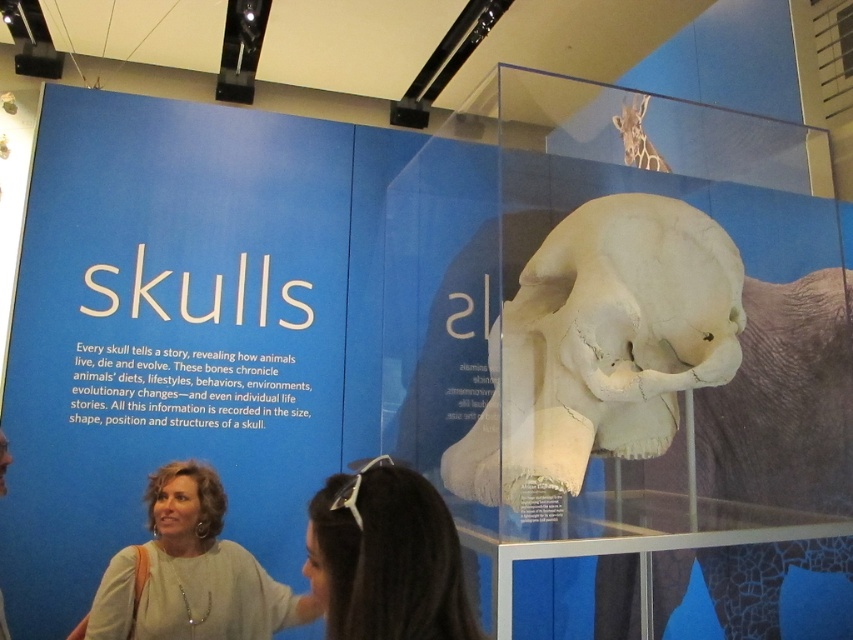
Who is taller, white matte skull at center or light beige sweater at lower left?

With more height is white matte skull at center.

Between white matte skull at center and light beige sweater at lower left, which one is positioned lower?

light beige sweater at lower left

At what (x,y) coordinates should I click in order to perform the action: click on white matte skull at center. Please return your answer as a coordinate pair (x, y). Image resolution: width=853 pixels, height=640 pixels. Looking at the image, I should click on (662, 368).

Can you confirm if white matte skull at center is smaller than dark brown hair at lower center?

No, white matte skull at center is not smaller than dark brown hair at lower center.

Is white matte skull at center taller than dark brown hair at lower center?

Yes, white matte skull at center is taller than dark brown hair at lower center.

Image resolution: width=853 pixels, height=640 pixels. Describe the element at coordinates (662, 368) in the screenshot. I see `white matte skull at center` at that location.

The image size is (853, 640). Find the location of `white matte skull at center`. white matte skull at center is located at coordinates (662, 368).

Consider the image. Which is above, dark brown hair at lower center or light beige sweater at lower left?

dark brown hair at lower center

Describe the element at coordinates (387, 560) in the screenshot. I see `dark brown hair at lower center` at that location.

At what (x,y) coordinates should I click in order to perform the action: click on dark brown hair at lower center. Please return your answer as a coordinate pair (x, y). The image size is (853, 640). Looking at the image, I should click on (387, 560).